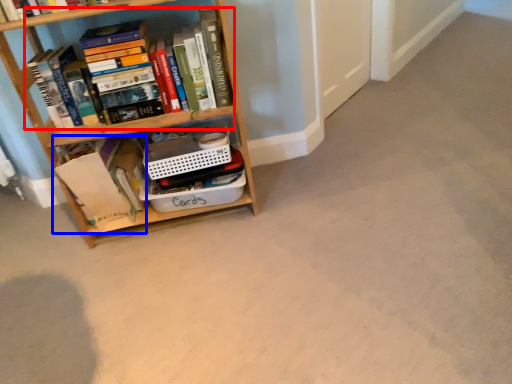
Question: Which object appears farthest to the camera in this image, book (highlighted by a red box) or book (highlighted by a blue box)?

Choices:
 (A) book
 (B) book

Answer: (B)